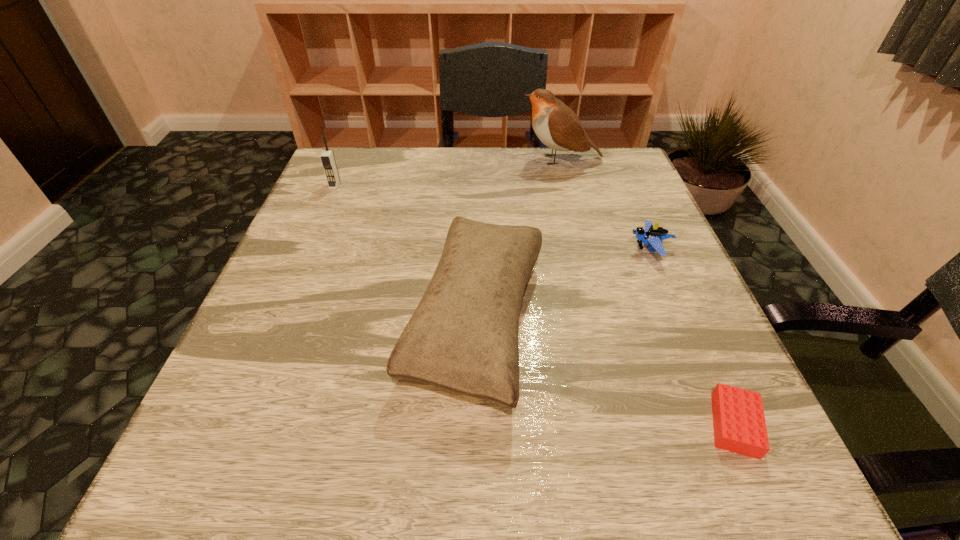
Find the location of a particular element. This screenshot has width=960, height=540. the tallest object is located at coordinates (557, 126).

Where is `bird`? bird is located at coordinates (557, 126).

Locate an element on the screen. This screenshot has height=540, width=960. the fourth shortest object is located at coordinates (327, 157).

This screenshot has width=960, height=540. I want to click on the fourth nearest object, so click(x=327, y=157).

Where is `the third shortest object`? This screenshot has height=540, width=960. the third shortest object is located at coordinates (463, 336).

Locate an element on the screen. the second shortest object is located at coordinates (653, 236).

I want to click on the farther Lego, so click(653, 236).

What are the coordinates of `the shortest object` in the screenshot? It's located at (739, 424).

Locate an element on the screen. This screenshot has width=960, height=540. the nearer Lego is located at coordinates (739, 424).

I want to click on vacant point located at the face of the bird, so (x=482, y=159).